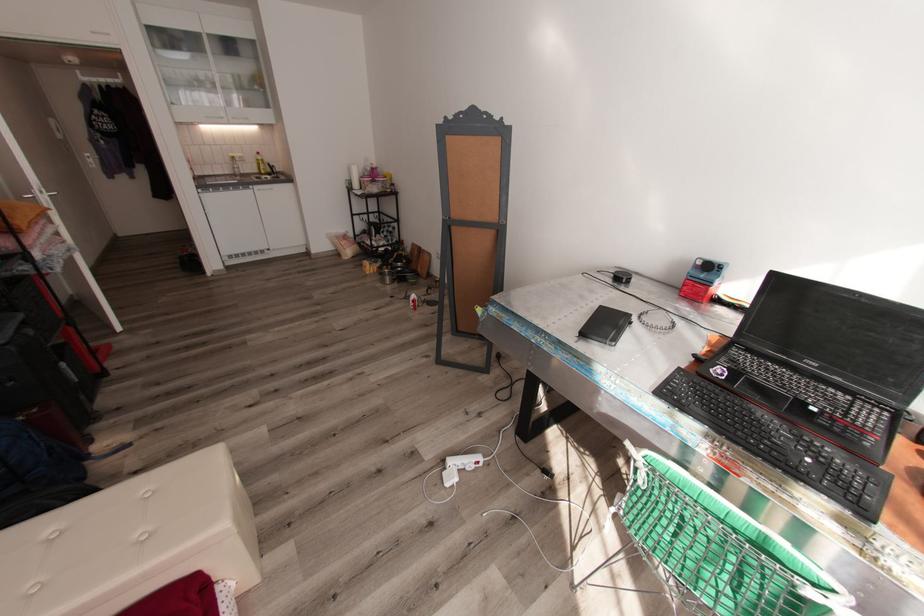
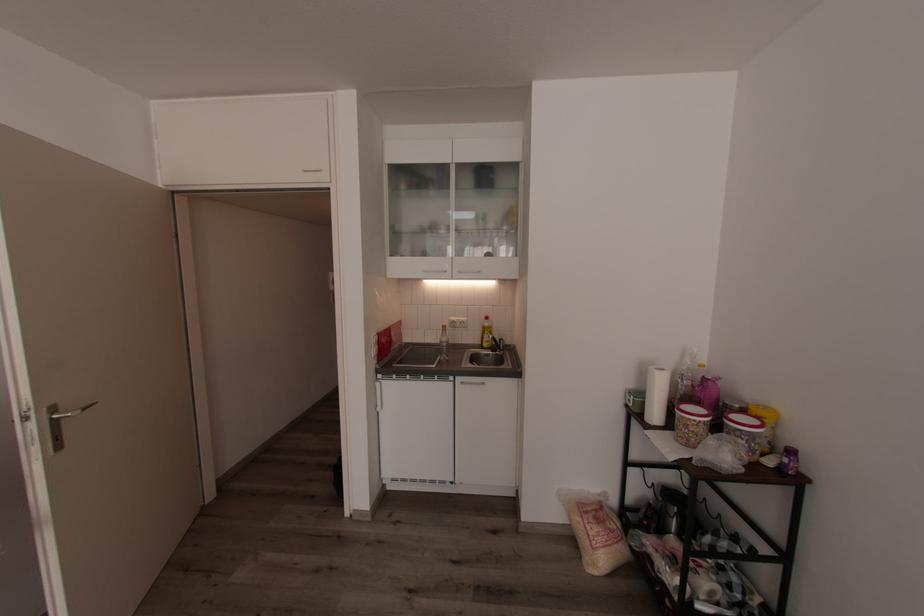
Locate, in the second image, the point that corresponds to (346,244) in the first image.

(594, 533)